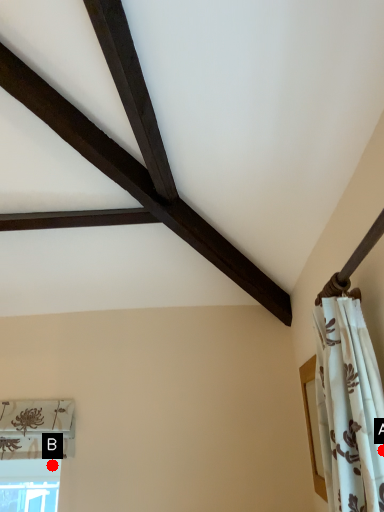
Question: Two points are circled on the image, labeled by A and B beside each circle. Which point is further to the camera?

Choices:
 (A) A is further
 (B) B is further

Answer: (B)